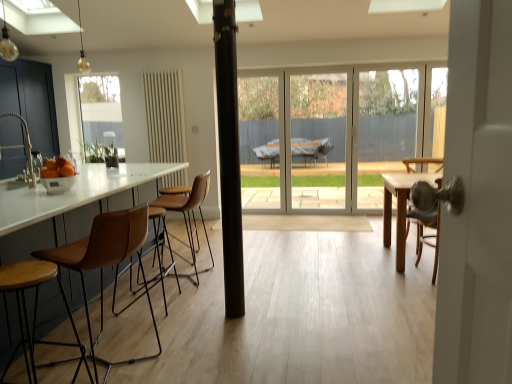
This screenshot has height=384, width=512. Identify the location of free space behind black matte pole at center. (243, 297).